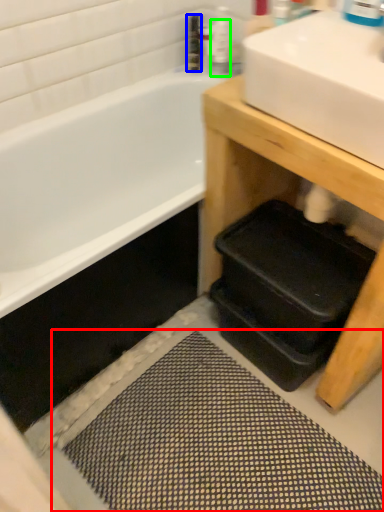
Question: Estimate the real-world distances between objects in this image. Which object is farther from bath mat (highlighted by a red box), toiletry (highlighted by a blue box) or toiletry (highlighted by a green box)?

Choices:
 (A) toiletry
 (B) toiletry

Answer: (A)